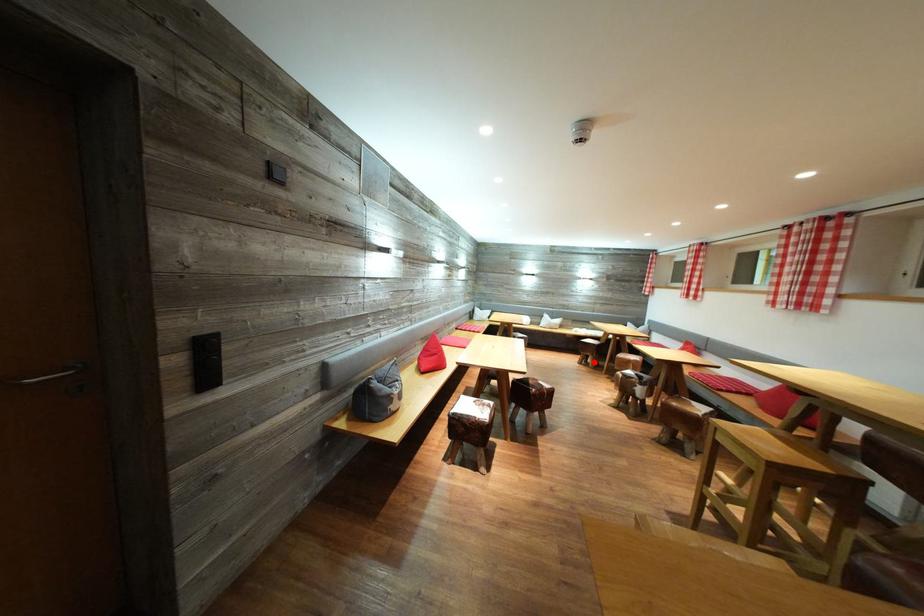
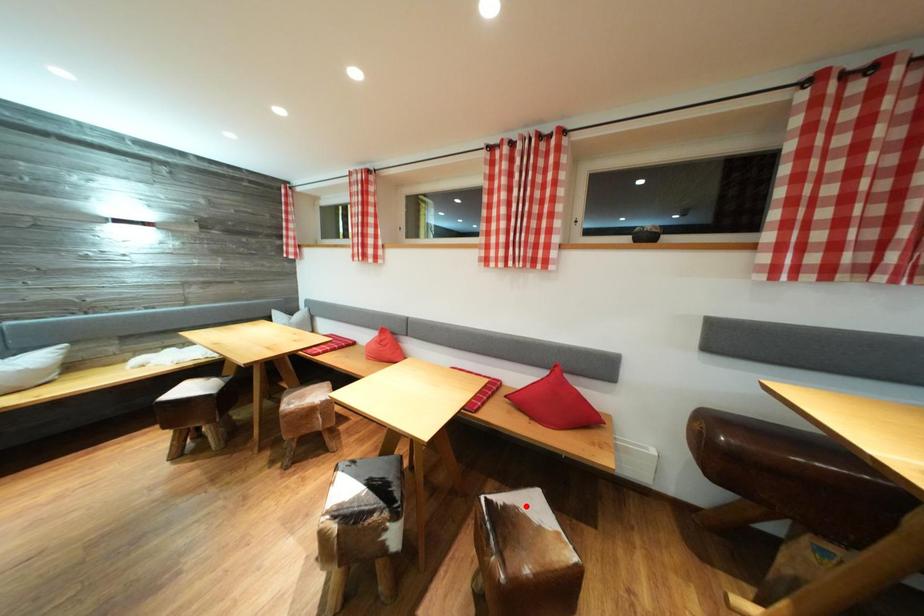
I am providing you with two images of the same scene from different viewpoints. A red point is marked on the first image and another point is marked on the second image. Does the point marked in image1 correspond to the same location as the one in image2?

No